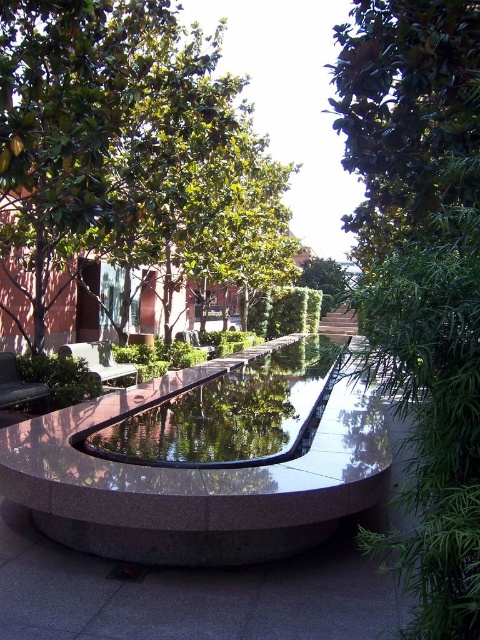
You are standing in the courtyard and want to take a photo of the green leafy tree at center and the glossy concrete pond at center. Which object will appear taller in the photo?

The green leafy tree at center will appear taller in the photo because it has a greater height compared to the glossy concrete pond at center.

You are standing at the edge of the water feature in the courtyard. You want to place a small decorative statue exactly at the center of the green leafy tree at center. Can you determine the coordinates where you should place it?

The green leafy tree at center is located at point (x=422, y=269), so you should place the statue at those coordinates to position it exactly at the center of the tree.